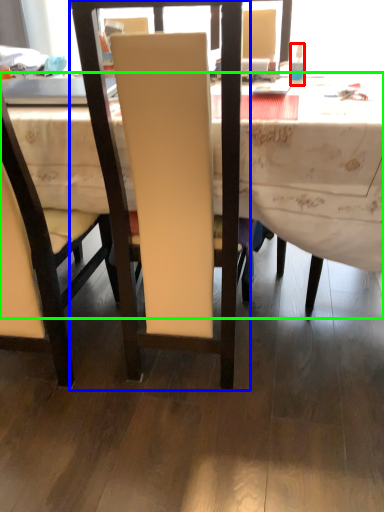
Question: Considering the real-world distances, which object is closest to bottle (highlighted by a red box)? chair (highlighted by a blue box) or desk (highlighted by a green box).

Choices:
 (A) chair
 (B) desk

Answer: (B)